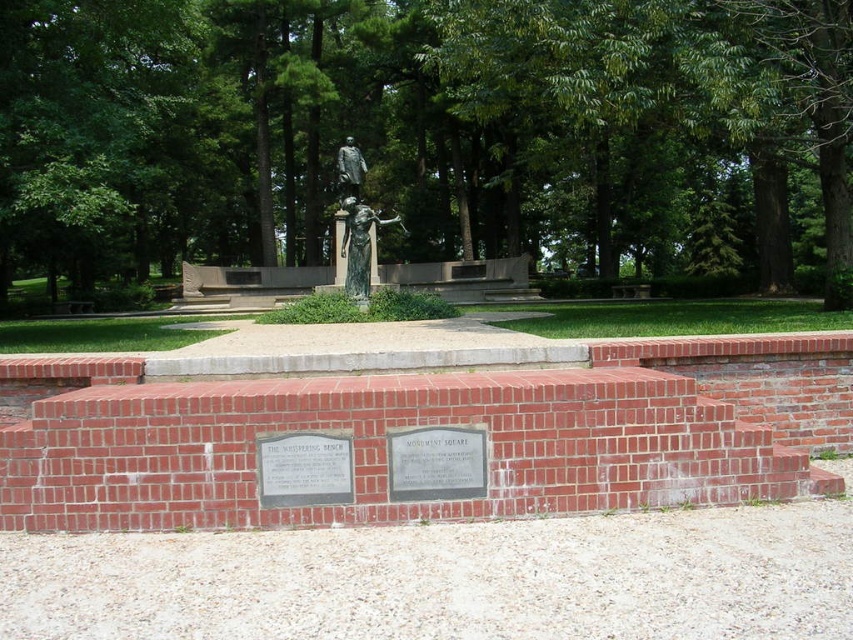
The image size is (853, 640). I want to click on green patina bronze statue at center, so click(x=357, y=221).

Based on the photo, is the position of green patina bronze statue at center more distant than that of bronze statue at center?

No, it is in front of bronze statue at center.

Between point (366, 301) and point (352, 177), which one is positioned behind?

Positioned behind is point (352, 177).

Locate an element on the screen. green patina bronze statue at center is located at coordinates (357, 221).

Is green leafy tree at center below green patina bronze statue at center?

Incorrect, green leafy tree at center is not positioned below green patina bronze statue at center.

Is the position of green leafy tree at center more distant than that of green patina bronze statue at center?

No.

Does point (601, 26) come closer to viewer compared to point (345, 141)?

Yes, point (601, 26) is in front of point (345, 141).

The width and height of the screenshot is (853, 640). Identify the location of green leafy tree at center. (428, 134).

Is point (772, 189) positioned in front of point (341, 177)?

No.

Which is below, green leafy tree at center or bronze statue at center?

bronze statue at center is below.

Where is `green leafy tree at center`? The width and height of the screenshot is (853, 640). green leafy tree at center is located at coordinates (428, 134).

This screenshot has height=640, width=853. I want to click on green leafy tree at center, so click(428, 134).